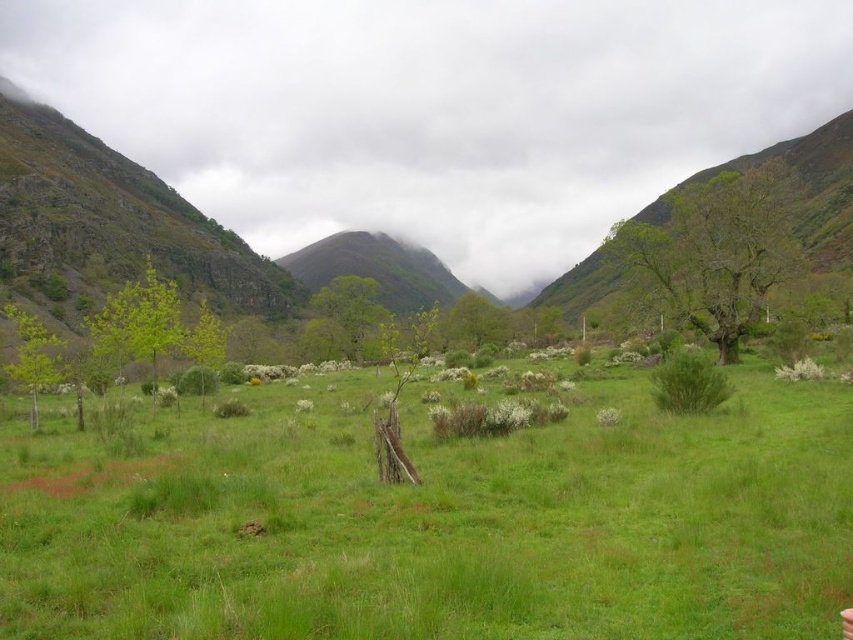
Question: Which point is farther to the camera?

Choices:
 (A) (270, 388)
 (B) (90, 192)

Answer: (B)

Question: Among these objects, which one is farthest from the camera?

Choices:
 (A) green grassy at center
 (B) green grassy mountain at left

Answer: (B)

Question: Is green grassy at center wider than green grassy mountain at left?

Choices:
 (A) yes
 (B) no

Answer: (B)

Question: Is green grassy at center behind green grassy mountain at left?

Choices:
 (A) yes
 (B) no

Answer: (B)

Question: Considering the relative positions of green grassy at center and green grassy mountain at left in the image provided, where is green grassy at center located with respect to green grassy mountain at left?

Choices:
 (A) left
 (B) right

Answer: (B)